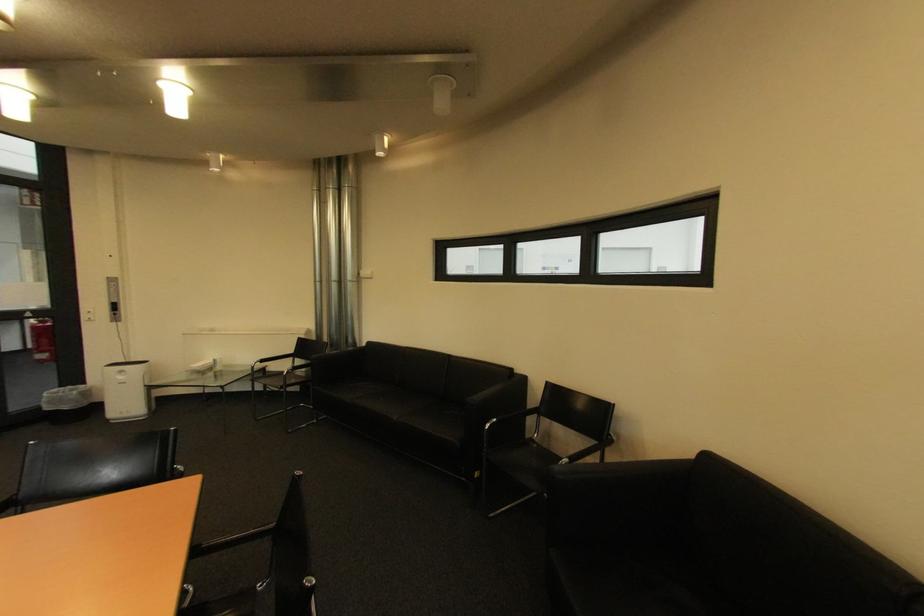
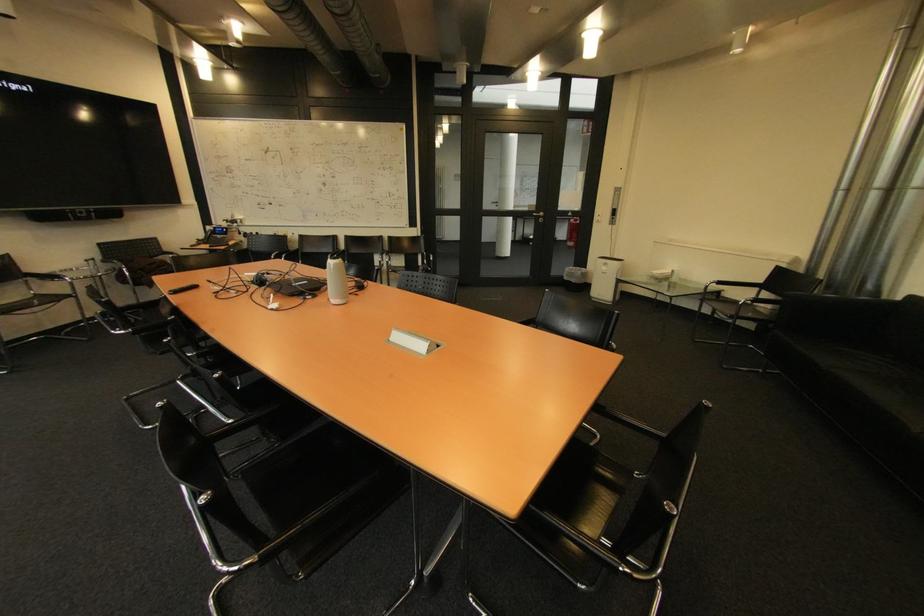
Where in the second image is the point corresponding to (x=129, y=379) from the first image?

(613, 270)